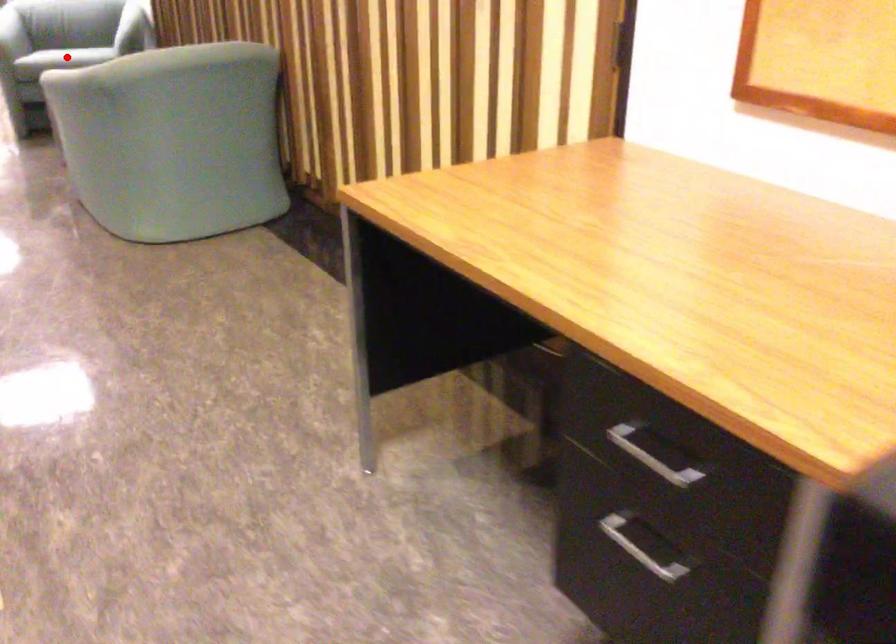
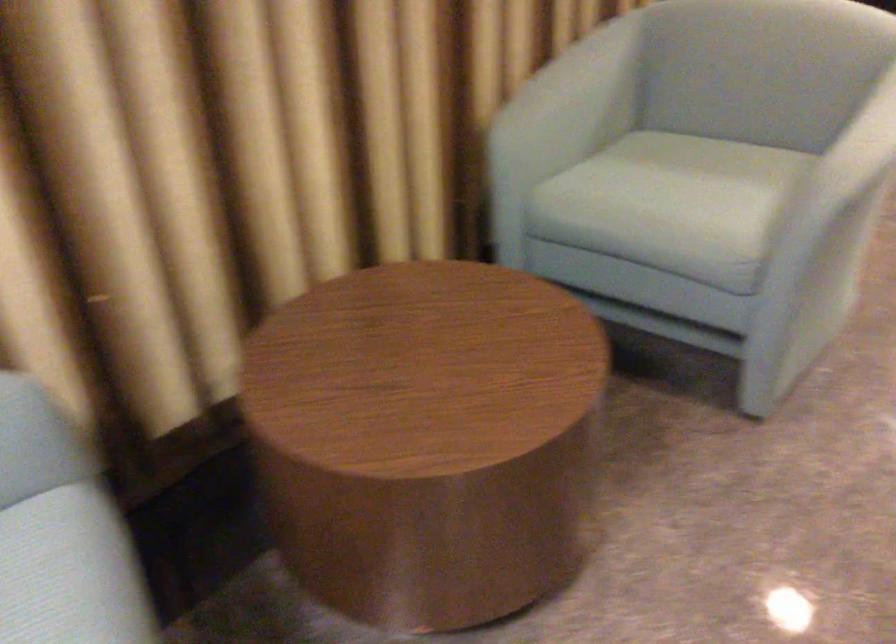
Question: I am providing you with two images of the same scene from different viewpoints. A red point is marked on the first image. Can you still see the location of the red point in image 2?

Choices:
 (A) Yes
 (B) No

Answer: (B)